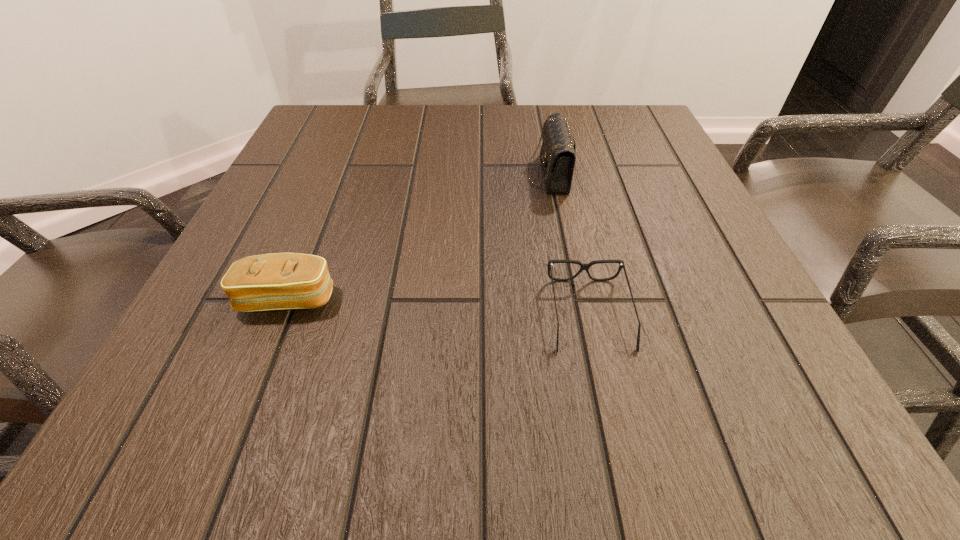
At what (x,y) coordinates should I click in order to perform the action: click on the right clutch bag. Please return your answer as a coordinate pair (x, y). This screenshot has height=540, width=960. Looking at the image, I should click on (558, 151).

In order to click on the taller clutch bag in this screenshot , I will do `click(558, 151)`.

You are a GUI agent. You are given a task and a screenshot of the screen. Output one action in this format:
    pyautogui.click(x=<x>, y=<y>)
    Task: Click on the second shortest object
    The image size is (960, 540).
    Given the screenshot: What is the action you would take?
    pyautogui.click(x=279, y=281)

Locate an element on the screen. the leftmost object is located at coordinates (279, 281).

Identify the location of spectacles. This screenshot has height=540, width=960. (586, 267).

You are a GUI agent. You are given a task and a screenshot of the screen. Output one action in this format:
    pyautogui.click(x=<x>, y=<y>)
    Task: Click on the free space located on the front flap of the tallest object
    This screenshot has width=960, height=540.
    Given the screenshot: What is the action you would take?
    pyautogui.click(x=380, y=173)

Identify the location of vacant point located on the front flap of the tallest object. The height and width of the screenshot is (540, 960). pos(423,173).

Where is `vacant space located on the front flap of the tallest object`? The height and width of the screenshot is (540, 960). vacant space located on the front flap of the tallest object is located at coordinates (423, 173).

Locate an element on the screen. vacant point located on the zipper side of the second shortest object is located at coordinates (236, 429).

Where is `vacant space situated with the lenses facing outward on the shortest object`? This screenshot has height=540, width=960. vacant space situated with the lenses facing outward on the shortest object is located at coordinates (615, 436).